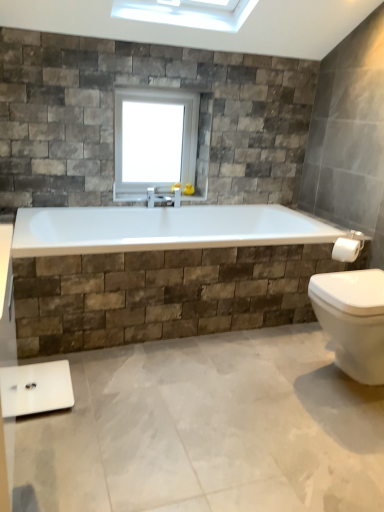
Question: Is white glossy scale at lower left spatially inside white glossy towel bar at right, or outside of it?

Choices:
 (A) outside
 (B) inside

Answer: (A)

Question: Considering the positions of white glossy scale at lower left and white glossy towel bar at right in the image, is white glossy scale at lower left taller or shorter than white glossy towel bar at right?

Choices:
 (A) short
 (B) tall

Answer: (A)

Question: Considering the real-world distances, which object is farthest from the white glass window at upper center?

Choices:
 (A) white glossy scale at lower left
 (B) white glossy towel bar at right

Answer: (A)

Question: Which of these objects is positioned closest to the white glossy towel bar at right?

Choices:
 (A) white glossy scale at lower left
 (B) white glass window at upper center

Answer: (B)